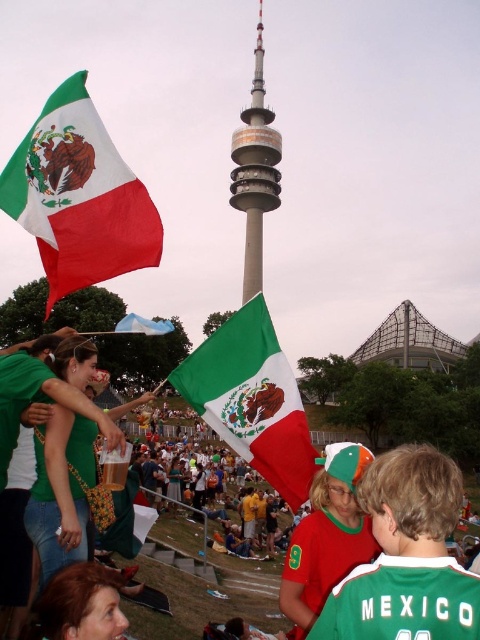
You are a photographer at the event and want to capture a photo that includes both the red fabric flag at upper left and the smooth metallic tower at center. Based on their positions, which object should you ensure is placed lower in the frame to include both?

The red fabric flag at upper left is below the smooth metallic tower at center, so to include both in the frame, you should ensure the red fabric flag at upper left is placed lower in the frame.

You are a photographer standing at the front of the crowd, and you want to take a closeup shot of the red fabric flag at upper left. Given that your camera has a maximum zoom range of 100 meters, will you be able to capture a clear closeup of the flag?

The red fabric flag at upper left is 136.24 meters away from the camera. Since the camera can only zoom up to 100 meters, you won

You are standing in the crowd at this event and want to take a photo of both the point at coordinates (289, 595) and the point at (274, 200). Which point should you focus on first to ensure both are in focus?

You should focus on the point at (289, 595) first because it is closer to the camera. This ensures that both points will be in focus as the camera adjusts for the closer point.